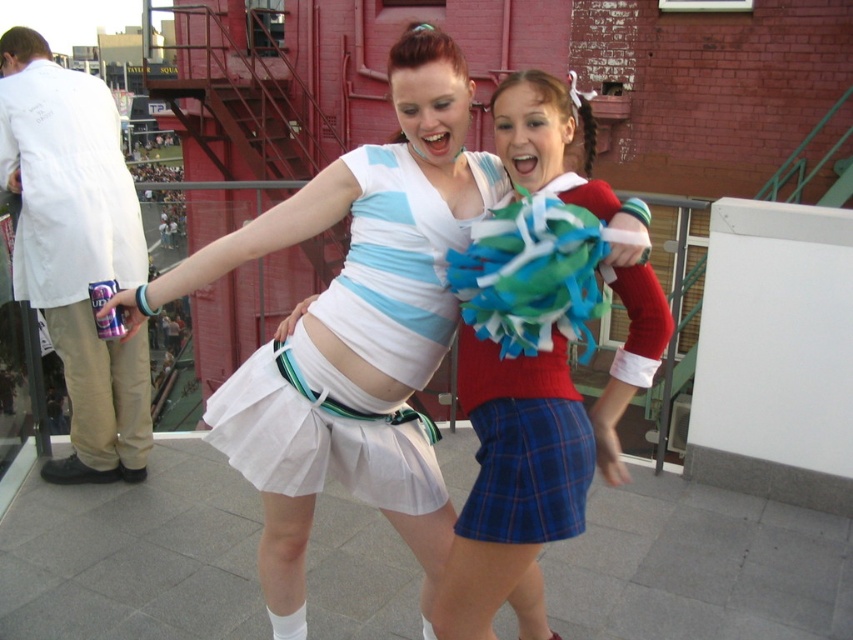
Question: Is white matte lab coat at left to the right of blue plaid skirt at lower center from the viewer's perspective?

Choices:
 (A) yes
 (B) no

Answer: (B)

Question: Which object is positioned closest to the plaid fabric skirt at center?

Choices:
 (A) white matte lab coat at left
 (B) white matte skirt at center
 (C) blue plaid skirt at lower center

Answer: (C)

Question: Can you confirm if plaid fabric skirt at center is positioned above white matte lab coat at left?

Choices:
 (A) no
 (B) yes

Answer: (A)

Question: Based on their relative distances, which object is farther from the white pleated skirt at center?

Choices:
 (A) plaid fabric skirt at center
 (B) blue plaid skirt at lower center

Answer: (A)

Question: Is plaid fabric skirt at center to the right of white pleated skirt at center from the viewer's perspective?

Choices:
 (A) no
 (B) yes

Answer: (B)

Question: Which point is closer to the camera?

Choices:
 (A) white pleated skirt at center
 (B) plaid fabric skirt at center
 (C) blue plaid skirt at lower center

Answer: (C)